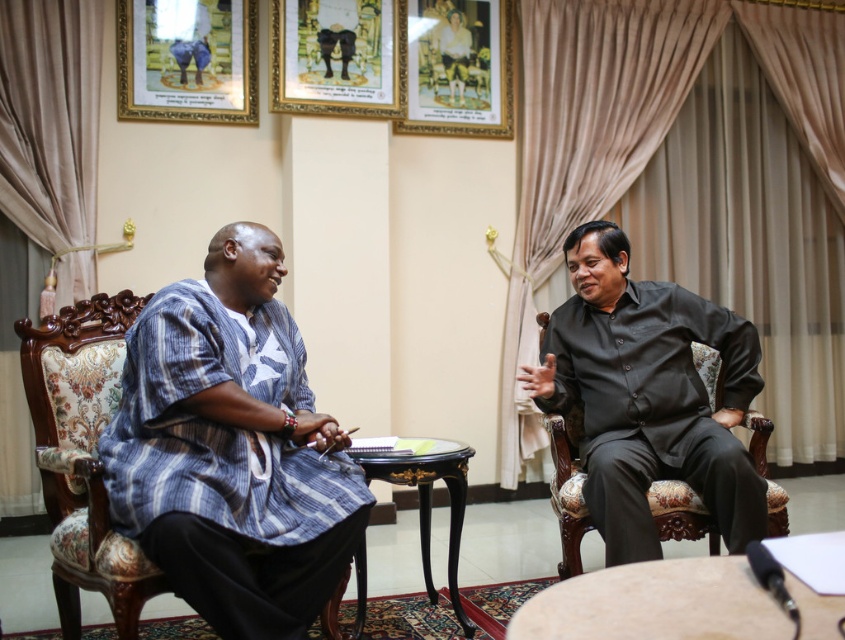
You are an interior designer observing the formal meeting room. You notice the blue striped shirt at left and the matte wooden picture frame at upper left. Which object is closer to the ceiling?

The matte wooden picture frame at upper left is closer to the ceiling because it is positioned above the blue striped shirt at left.